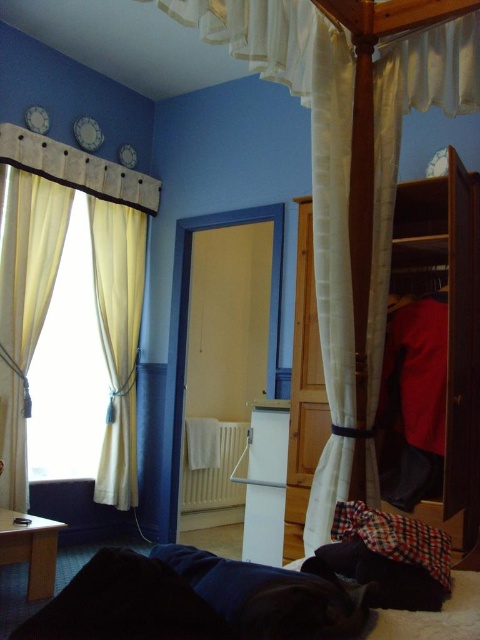
How far apart are wooden wardrobe at right and matte cream curtain at left?

7.83 feet

Which is below, wooden wardrobe at right or matte cream curtain at left?

matte cream curtain at left

Describe the element at coordinates (450, 323) in the screenshot. Image resolution: width=480 pixels, height=640 pixels. I see `wooden wardrobe at right` at that location.

The image size is (480, 640). What are the coordinates of `wooden wardrobe at right` in the screenshot? It's located at (450, 323).

Is matte cream curtain at left wider than matte white curtain at left?

No, matte cream curtain at left is not wider than matte white curtain at left.

Is matte cream curtain at left thinner than matte white curtain at left?

Correct, matte cream curtain at left's width is less than matte white curtain at left's.

Does point (8, 346) lie behind point (120, 344)?

No, (8, 346) is in front of (120, 344).

I want to click on matte cream curtain at left, so click(24, 301).

Can you confirm if light beige curtain at left is positioned above matte cream curtain at left?

Actually, light beige curtain at left is below matte cream curtain at left.

Who is lower down, light beige curtain at left or matte cream curtain at left?

light beige curtain at left

This screenshot has width=480, height=640. Identify the location of light beige curtain at left. (69, 368).